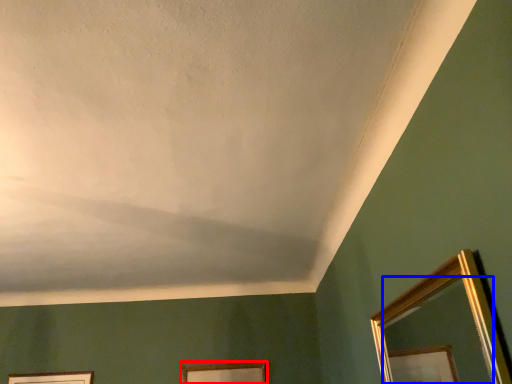
Question: Which point is closer to the camera, picture frame (highlighted by a red box) or mirror (highlighted by a blue box)?

Choices:
 (A) picture frame
 (B) mirror

Answer: (B)